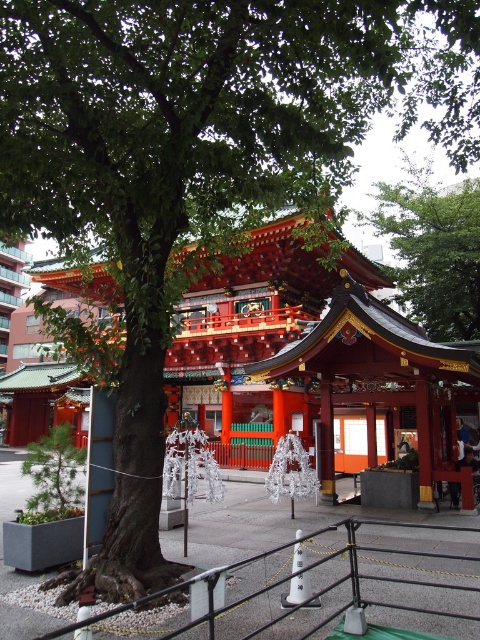
Question: Among these points, which one is nearest to the camera?

Choices:
 (A) (307, 616)
 (B) (405, 262)

Answer: (A)

Question: Is black metal/rail at center wider than green leafy tree at upper center?

Choices:
 (A) no
 (B) yes

Answer: (A)

Question: Observing the image, what is the correct spatial positioning of black metal/rail at center in reference to green leafy tree at upper center?

Choices:
 (A) left
 (B) right

Answer: (A)

Question: Which object is farther from the camera taking this photo?

Choices:
 (A) black metal/rail at center
 (B) green leafy tree at upper center

Answer: (B)

Question: Which point is farther to the camera?

Choices:
 (A) (421, 257)
 (B) (286, 620)

Answer: (A)

Question: Is black metal/rail at center above green leafy tree at upper center?

Choices:
 (A) no
 (B) yes

Answer: (A)